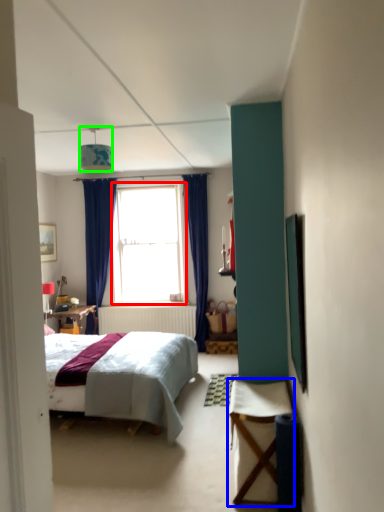
Question: Considering the real-world distances, which object is closest to window (highlighted by a red box)? table (highlighted by a blue box) or lamp (highlighted by a green box).

Choices:
 (A) table
 (B) lamp

Answer: (B)